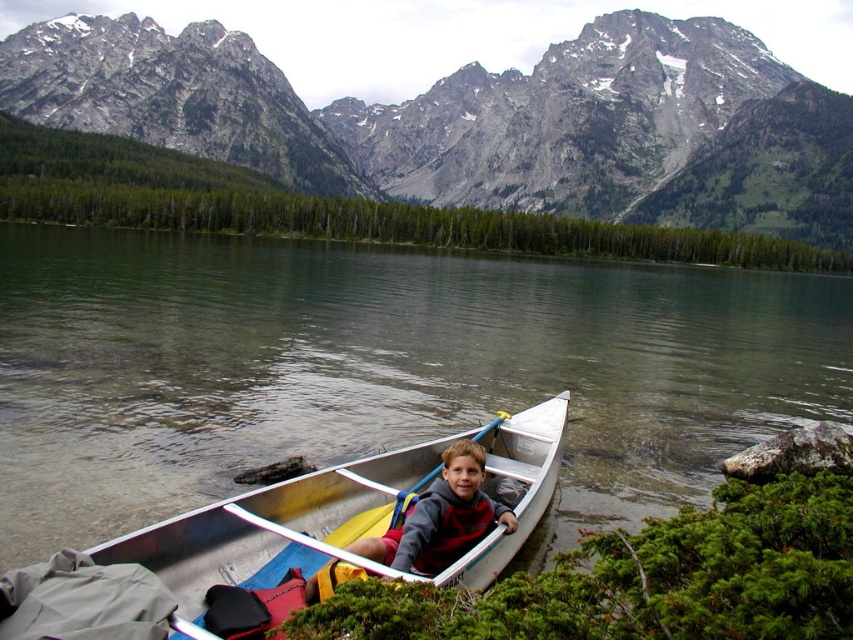
From the picture: You are standing on the shore and want to take a photo of the gray rocky mountain at upper center and the silver metallic canoe at center. Which object should you focus on first to ensure both are in the frame?

You should focus on the gray rocky mountain at upper center first because it is closer to you than the silver metallic canoe at center, ensuring both are in the frame.

You are a photographer trying to capture the two points in the scene. Which point, point (x=483, y=195) or point (x=379, y=516), is closer to the camera?

Point (x=379, y=516) is closer to the camera than point (x=483, y=195).